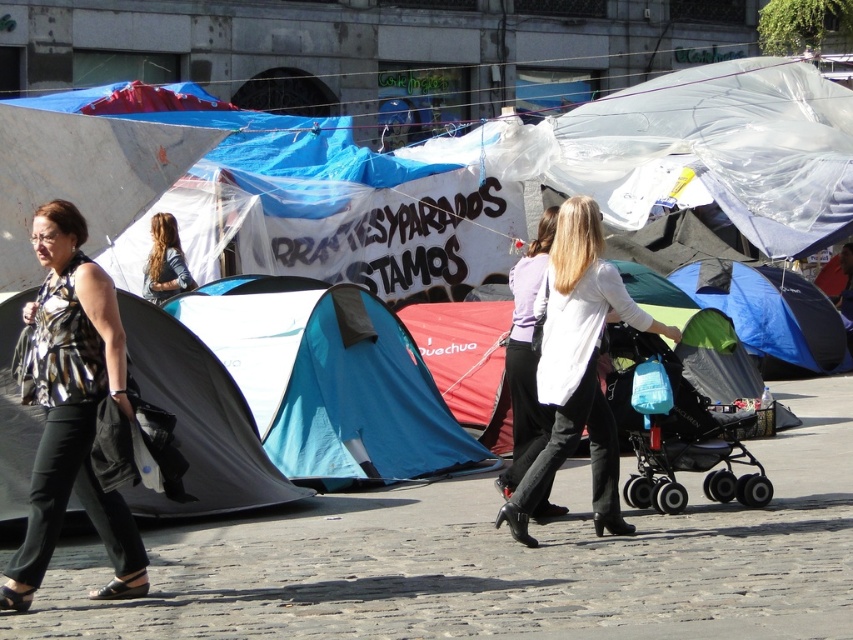
Is black fabric tent at left thinner than green fabric stroller at center?

Incorrect, black fabric tent at left's width is not less than green fabric stroller at center's.

The width and height of the screenshot is (853, 640). What do you see at coordinates (198, 420) in the screenshot? I see `black fabric tent at left` at bounding box center [198, 420].

You are a GUI agent. You are given a task and a screenshot of the screen. Output one action in this format:
    pyautogui.click(x=<x>, y=<y>)
    Task: Click on the black fabric tent at left
    The height and width of the screenshot is (640, 853).
    Given the screenshot: What is the action you would take?
    pyautogui.click(x=198, y=420)

Between printed fabric blouse at left and matte white blouse at center, which one has less height?

matte white blouse at center is shorter.

Which is more to the left, printed fabric blouse at left or matte white blouse at center?

printed fabric blouse at left is more to the left.

Which is behind, point (99, 289) or point (527, 291)?

The point (527, 291) is behind.

Where is `printed fabric blouse at left`? printed fabric blouse at left is located at coordinates (73, 408).

Does point (358, 376) come in front of point (558, 230)?

No.

Is blue fabric tent at center in front of white matte shirt at center?

No, it is not.

Locate an element on the screen. The image size is (853, 640). blue fabric tent at center is located at coordinates (329, 380).